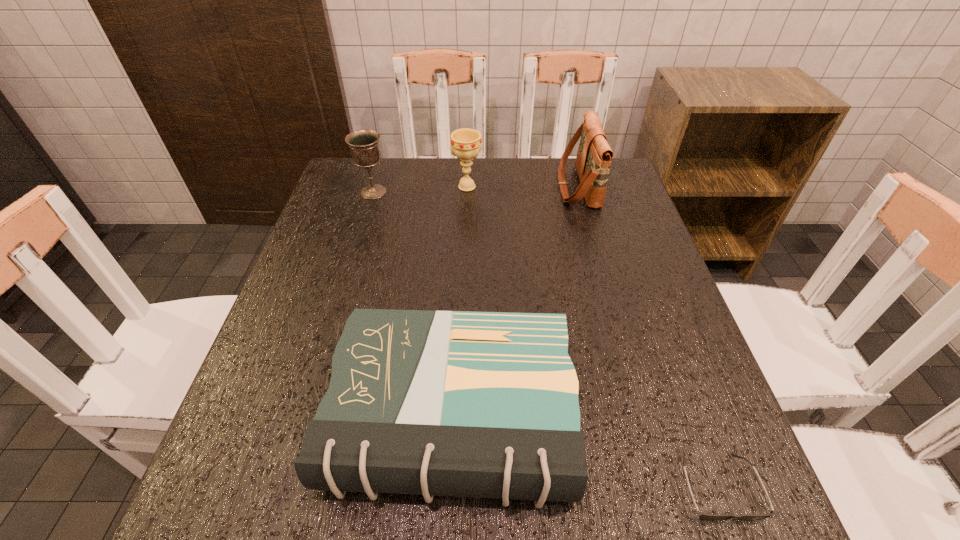
You are a GUI agent. You are given a task and a screenshot of the screen. Output one action in this format:
    pyautogui.click(x=<x>, y=<y>)
    Task: Click on the shoulder bag
    Image resolution: width=960 pixels, height=540 pixels.
    Given the screenshot: What is the action you would take?
    pyautogui.click(x=593, y=161)

Locate an element on the screen. The width and height of the screenshot is (960, 540). the leftmost object is located at coordinates (364, 144).

Identify the location of the right chalice. This screenshot has height=540, width=960. (465, 143).

At what (x,y) coordinates should I click in order to perform the action: click on the second shortest object. Please return your answer as a coordinate pair (x, y). This screenshot has height=540, width=960. Looking at the image, I should click on (436, 403).

You are a GUI agent. You are given a task and a screenshot of the screen. Output one action in this format:
    pyautogui.click(x=<x>, y=<y>)
    Task: Click on the sunglasses
    
    Given the screenshot: What is the action you would take?
    pyautogui.click(x=710, y=517)

You are a GUI agent. You are given a task and a screenshot of the screen. Output one action in this format:
    pyautogui.click(x=<x>, y=<y>)
    Task: Click on the vacant region located 0.260m on the front-facing side of the shoulder bag
    Image resolution: width=960 pixels, height=540 pixels.
    Given the screenshot: What is the action you would take?
    pyautogui.click(x=468, y=187)

Find the location of a particular element. This screenshot has width=960, height=540. free space located 0.400m on the front-facing side of the shoulder bag is located at coordinates (419, 187).

Locate an element on the screen. free space located on the front-facing side of the shoulder bag is located at coordinates (540, 187).

Find the location of a particular element. The width and height of the screenshot is (960, 540). vacant space located on the front of the left chalice is located at coordinates (353, 261).

Image resolution: width=960 pixels, height=540 pixels. What are the coordinates of `blank area located on the left of the right chalice` in the screenshot? It's located at (358, 187).